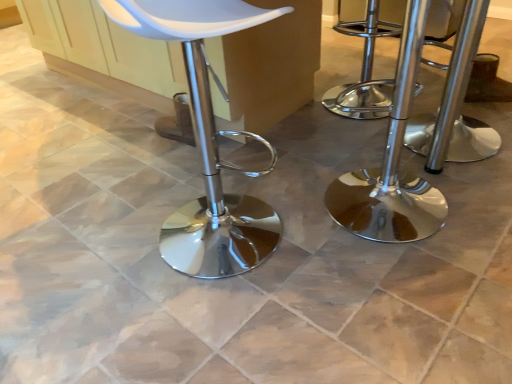
Question: Is polished chrome stool at center, the first stool when ordered from right to left, wider or thinner than chrome/metallic stool at right, the second stool positioned from the right?

Choices:
 (A) wide
 (B) thin

Answer: (B)

Question: From a real-world perspective, is polished chrome stool at center, which is the 2th stool from left to right, above or below chrome/metallic stool at right, acting as the first stool starting from the left?

Choices:
 (A) below
 (B) above

Answer: (A)

Question: Which object is positioned closest to the polished chrome stool at center, which is the 2th stool from left to right?

Choices:
 (A) white matte stool at center
 (B) chrome/metallic stool at right, acting as the first stool starting from the left

Answer: (B)

Question: Estimate the real-world distances between objects in this image. Which object is closer to the polished chrome stool at center, which is the 2th stool from left to right?

Choices:
 (A) chrome/metallic stool at right, acting as the first stool starting from the left
 (B) white matte stool at center

Answer: (A)